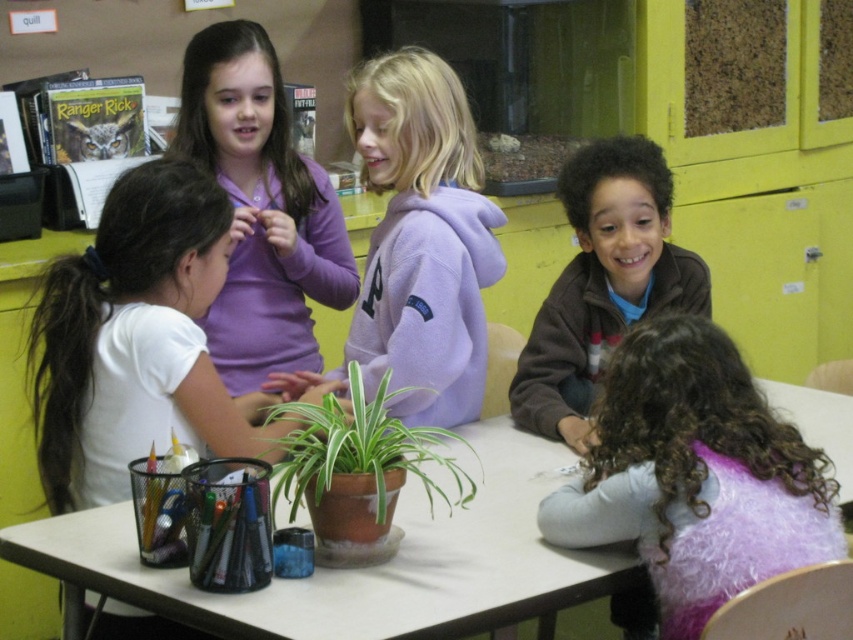
In the scene shown: Does curly hair at lower right lie behind purple fleece hoodie at upper left?

No.

Is point (675, 595) behind point (276, 246)?

No, it is not.

Who is more forward, (x=698, y=456) or (x=221, y=131)?

Point (x=698, y=456) is in front.

Locate an element on the screen. Image resolution: width=853 pixels, height=640 pixels. curly hair at lower right is located at coordinates (695, 476).

Who is positioned more to the left, white plastic table at center or curly hair at lower right?

white plastic table at center

Measure the distance from white plastic table at center to curly hair at lower right.

white plastic table at center and curly hair at lower right are 11.80 inches apart.

Is point (466, 588) closer to viewer compared to point (804, 445)?

Yes, it is.

In order to click on white plastic table at center in this screenshot , I will do `click(364, 568)`.

Can you confirm if white plastic table at center is positioned to the left of purple fleece hoodie at upper center?

Yes, white plastic table at center is to the left of purple fleece hoodie at upper center.

Who is positioned more to the left, white plastic table at center or purple fleece hoodie at upper center?

white plastic table at center is more to the left.

Between point (270, 608) and point (405, 374), which one is positioned in front?

Positioned in front is point (270, 608).

Identify the location of white plastic table at center. (364, 568).